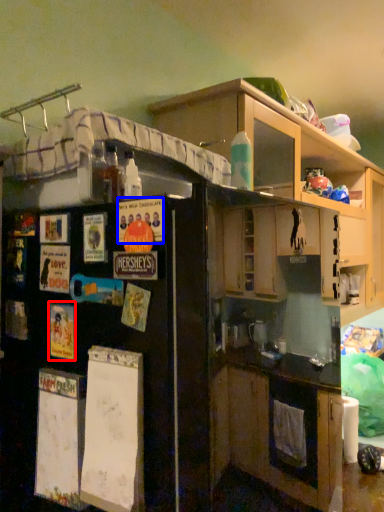
Question: Among these objects, which one is farthest to the camera, poster (highlighted by a red box) or poster (highlighted by a blue box)?

Choices:
 (A) poster
 (B) poster

Answer: (A)